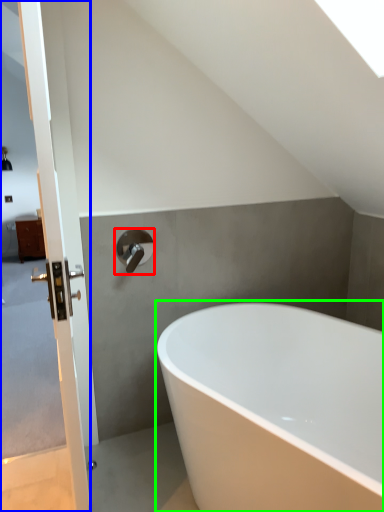
Question: Based on their relative distances, which object is nearer to tap (highlighted by a red box)? Choose from screen door (highlighted by a blue box) and bathtub (highlighted by a green box).

Choices:
 (A) screen door
 (B) bathtub

Answer: (A)